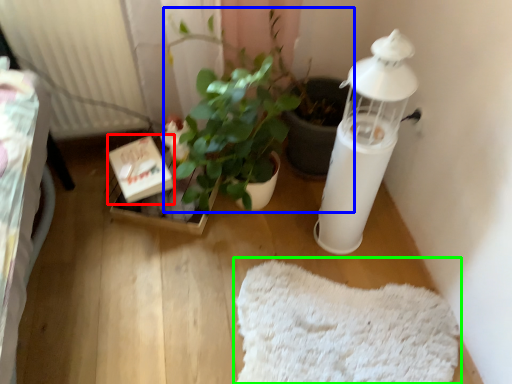
Question: Estimate the real-world distances between objects in this image. Which object is farther from cardboard box (highlighted by a red box), houseplant (highlighted by a blue box) or mat (highlighted by a green box)?

Choices:
 (A) houseplant
 (B) mat

Answer: (B)